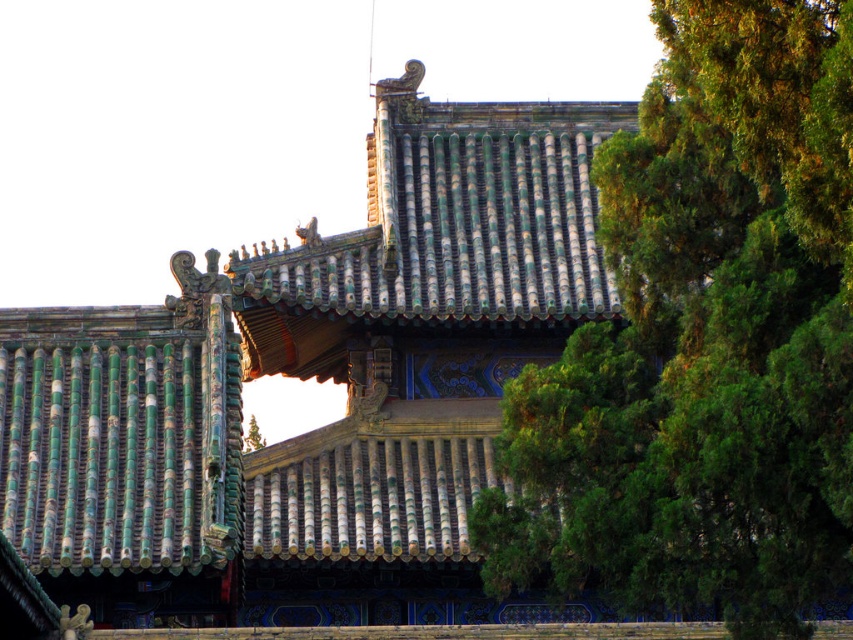
You are an architect examining the temple roof. You notice the green leafy tree at upper right and the green glazed tiles at center. Which object appears closer to you in the image?

The green glazed tiles at center appear closer to you because the green leafy tree at upper right is positioned behind them.

You are an architect examining the temple roof. You notice the green glazed tiles at center and the green leafy tree at upper right. Which object is positioned higher in the image?

The green glazed tiles at center are positioned higher than the green leafy tree at upper right in the image.

You are an architect analyzing the roof structure of this traditional East Asian building. Based on the image, where is the green glazed tiles at center located in terms of their 2D coordinates?

The green glazed tiles at center are located at the 2D coordinates point (x=317, y=380).